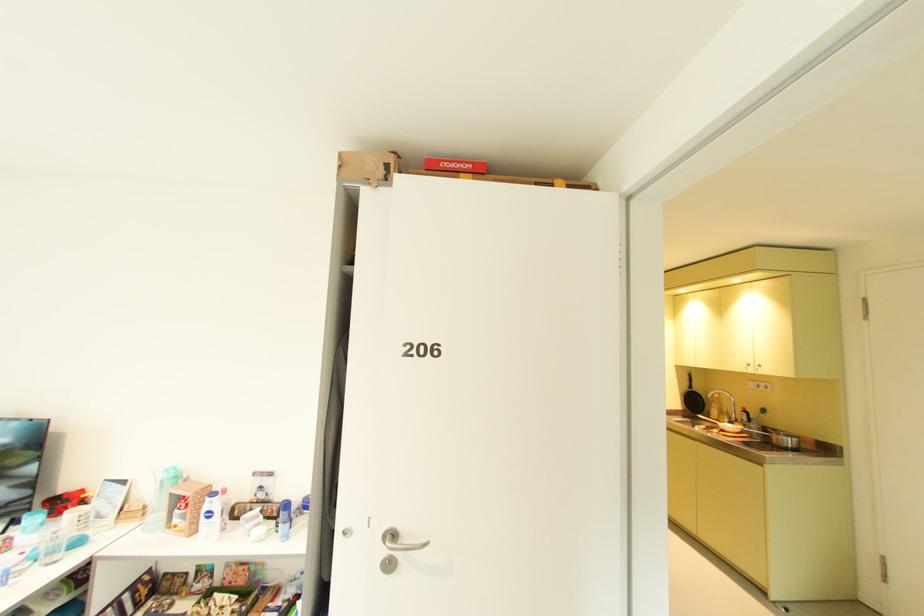
Where would you lift the red game box? Please return your answer as a coordinate pair (x, y).

(455, 164)